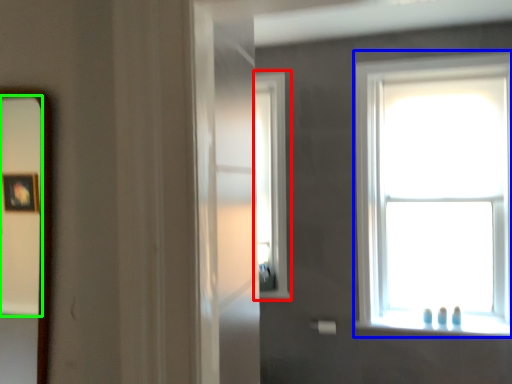
Question: Which object is positioned farthest from window (highlighted by a red box)? Select from window (highlighted by a blue box) and mirror (highlighted by a green box).

Choices:
 (A) window
 (B) mirror

Answer: (B)